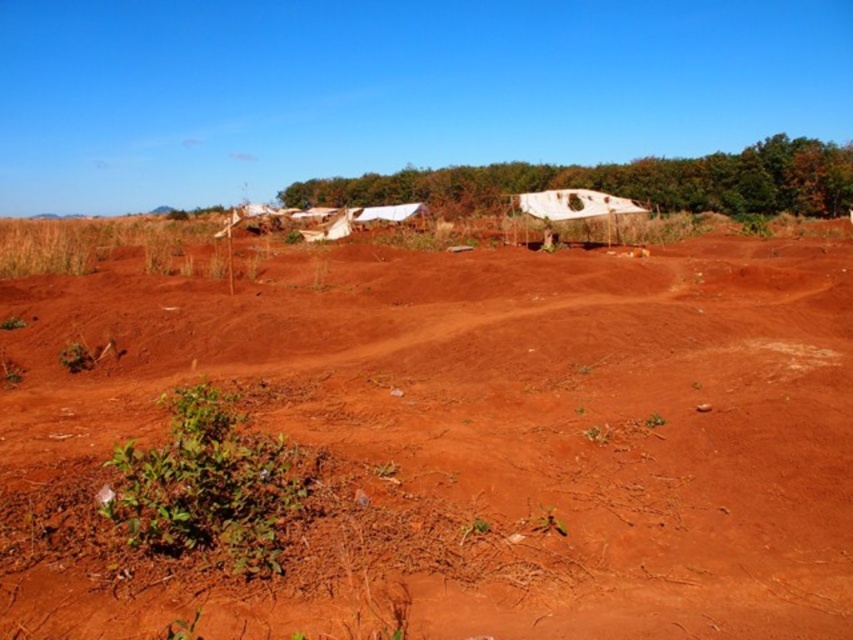
Who is lower down, dull reddish-brown soil at center or green leafy trees at upper center?

dull reddish-brown soil at center is lower down.

Describe the element at coordinates (459, 440) in the screenshot. I see `dull reddish-brown soil at center` at that location.

What are the coordinates of `dull reddish-brown soil at center` in the screenshot? It's located at [459, 440].

This screenshot has height=640, width=853. I want to click on dull reddish-brown soil at center, so click(x=459, y=440).

Measure the distance between green leafy trees at upper center and green leafy plant at lower left.

A distance of 211.33 feet exists between green leafy trees at upper center and green leafy plant at lower left.

This screenshot has height=640, width=853. What do you see at coordinates (622, 180) in the screenshot?
I see `green leafy trees at upper center` at bounding box center [622, 180].

Is point (450, 184) positioned after point (234, 509)?

Yes, point (450, 184) is behind point (234, 509).

Identify the location of green leafy trees at upper center. (622, 180).

Who is higher up, dull reddish-brown soil at center or green leafy plant at lower left?

dull reddish-brown soil at center is above.

Identify the location of dull reddish-brown soil at center. (459, 440).